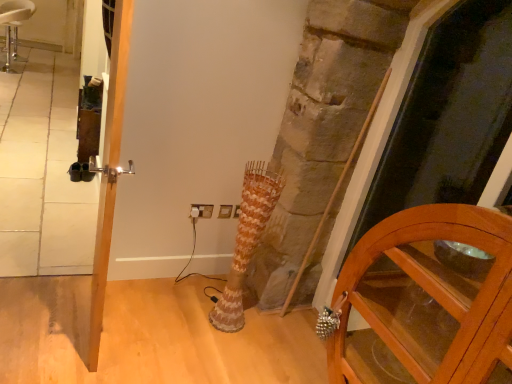
Question: Can you confirm if wooden cabinet at lower right is smaller than polished silver door handle at left?

Choices:
 (A) no
 (B) yes

Answer: (A)

Question: Considering the relative positions of wooden cabinet at lower right and polished silver door handle at left in the image provided, is wooden cabinet at lower right to the right of polished silver door handle at left from the viewer's perspective?

Choices:
 (A) yes
 (B) no

Answer: (A)

Question: Considering the relative sizes of wooden cabinet at lower right and polished silver door handle at left in the image provided, is wooden cabinet at lower right shorter than polished silver door handle at left?

Choices:
 (A) no
 (B) yes

Answer: (B)

Question: From the image's perspective, is wooden cabinet at lower right above polished silver door handle at left?

Choices:
 (A) no
 (B) yes

Answer: (A)

Question: Does wooden cabinet at lower right have a greater width compared to polished silver door handle at left?

Choices:
 (A) yes
 (B) no

Answer: (A)

Question: Which is correct: white plastic electric outlet at center is inside wooden cabinet at lower right, or outside of it?

Choices:
 (A) outside
 (B) inside

Answer: (A)

Question: From a real-world perspective, is white plastic electric outlet at center physically located above or below wooden cabinet at lower right?

Choices:
 (A) above
 (B) below

Answer: (B)

Question: In terms of width, does white plastic electric outlet at center look wider or thinner when compared to wooden cabinet at lower right?

Choices:
 (A) thin
 (B) wide

Answer: (A)

Question: Based on their sizes in the image, would you say white plastic electric outlet at center is bigger or smaller than wooden cabinet at lower right?

Choices:
 (A) small
 (B) big

Answer: (A)

Question: Looking at their shapes, would you say white leather stool at upper left is wider or thinner than white plastic electric outlet at center?

Choices:
 (A) wide
 (B) thin

Answer: (A)

Question: Based on their sizes in the image, would you say white leather stool at upper left is bigger or smaller than white plastic electric outlet at center?

Choices:
 (A) small
 (B) big

Answer: (B)

Question: Is white leather stool at upper left taller or shorter than white plastic electric outlet at center?

Choices:
 (A) short
 (B) tall

Answer: (B)

Question: Does point (16, 1) appear closer or farther from the camera than point (195, 206)?

Choices:
 (A) farther
 (B) closer

Answer: (A)

Question: From the image's perspective, relative to wooden cabinet at lower right, is transparent glass screen door at right above or below?

Choices:
 (A) below
 (B) above

Answer: (B)

Question: From their relative heights in the image, would you say transparent glass screen door at right is taller or shorter than wooden cabinet at lower right?

Choices:
 (A) short
 (B) tall

Answer: (B)